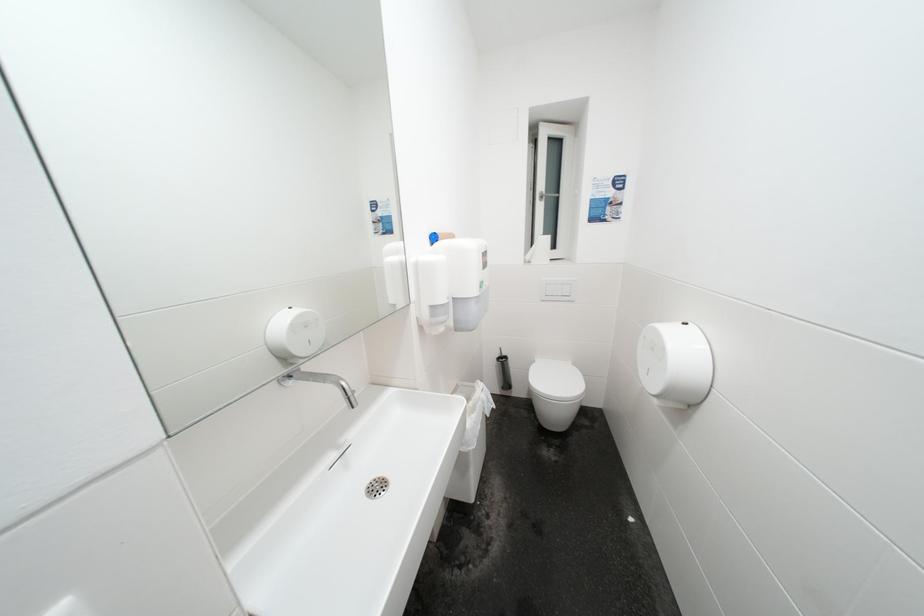
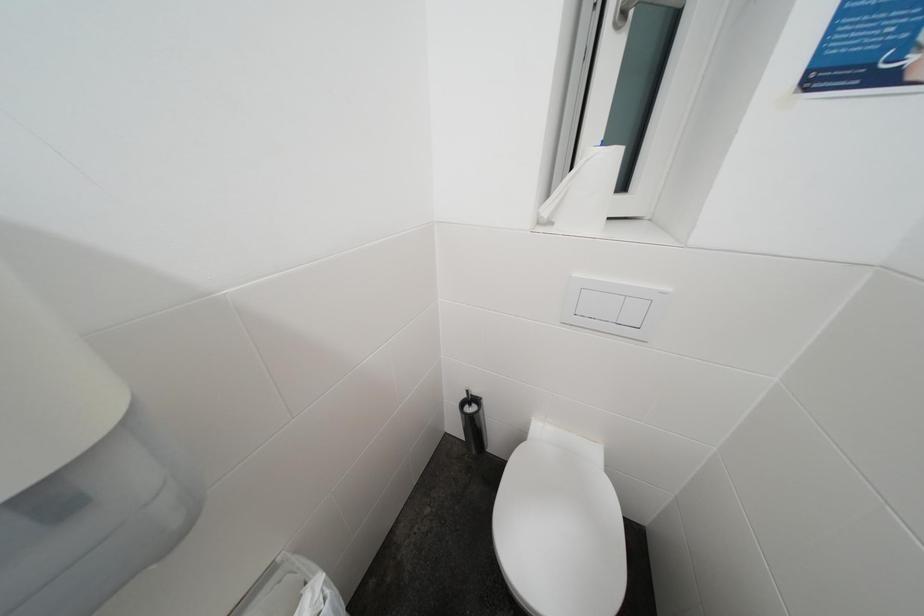
Question: In a continuous first-person perspective shot, in which direction is the camera moving?

Choices:
 (A) Left
 (B) Right
 (C) Forward
 (D) Backward

Answer: (C)